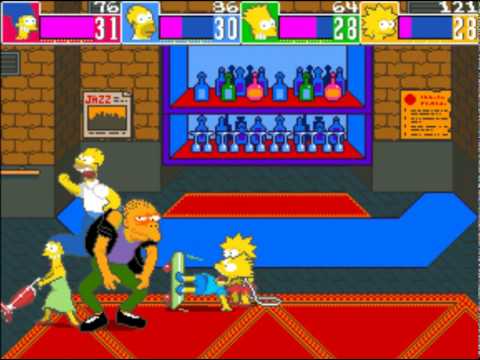
The width and height of the screenshot is (480, 360). Find the location of `calendar`. calendar is located at coordinates (105, 114).